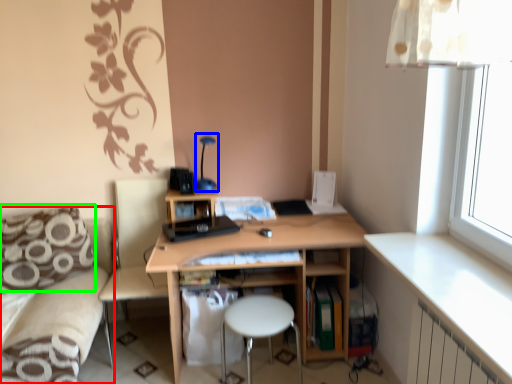
Question: Which object is positioned farthest from couch (highlighted by a red box)? Select from table lamp (highlighted by a blue box) and pillow (highlighted by a green box).

Choices:
 (A) table lamp
 (B) pillow

Answer: (A)